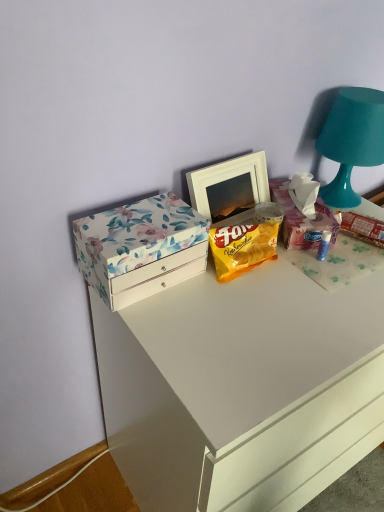
You are a GUI agent. You are given a task and a screenshot of the screen. Output one action in this format:
    pyautogui.click(x=<x>, y=<y>)
    Task: Click on the free point above white glossy chest of drawers at upper center (from a real-world perspective)
    
    Given the screenshot: What is the action you would take?
    pyautogui.click(x=290, y=288)